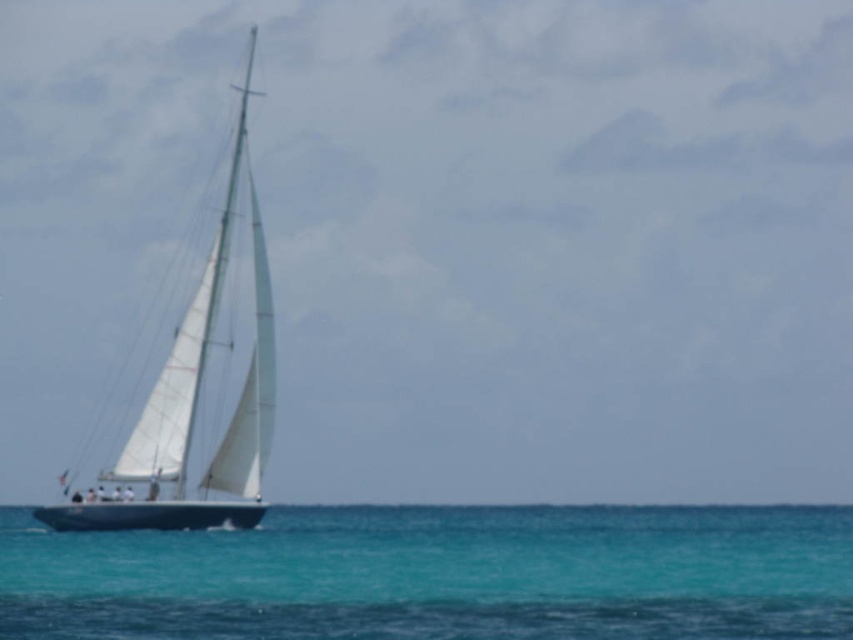
Can you confirm if clear blue water at center is positioned below white matte sailboat at left?

Yes.

Is the position of clear blue water at center more distant than that of white matte sailboat at left?

No, clear blue water at center is closer to the viewer.

In the scene shown: Who is more distant from viewer, (x=364, y=620) or (x=238, y=513)?

The point (x=238, y=513) is behind.

Locate an element on the screen. The height and width of the screenshot is (640, 853). clear blue water at center is located at coordinates (440, 573).